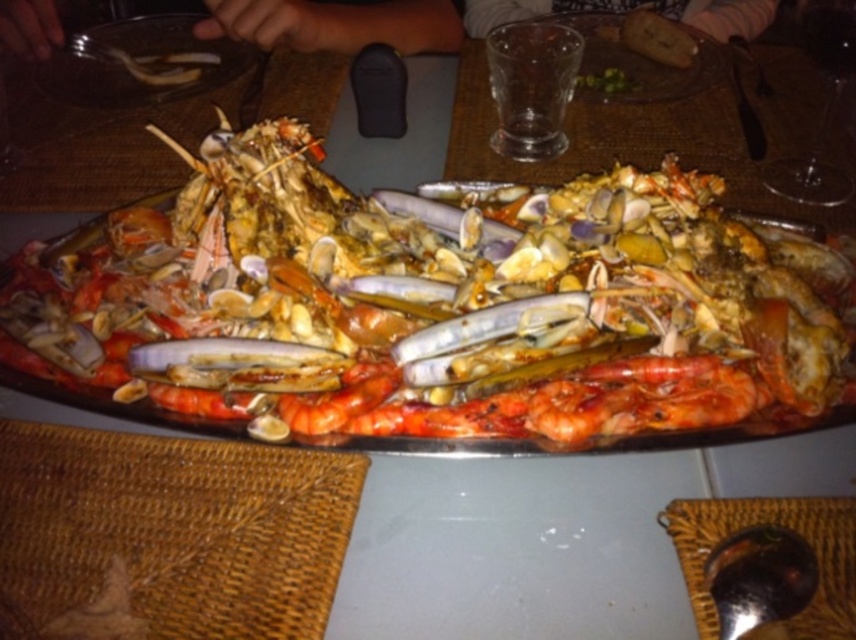
Is shiny red prawns at center bigger than matte glass platter at upper center?

Yes, shiny red prawns at center is bigger than matte glass platter at upper center.

Between point (10, 273) and point (704, 42), which one is positioned in front?

Point (10, 273)

Is point (224, 166) more distant than point (598, 67)?

No, it is not.

This screenshot has height=640, width=856. In order to click on shiny red prawns at center in this screenshot , I will do `click(434, 301)`.

Who is lower down, shiny red prawns at center or shiny red prawn at center?

shiny red prawn at center is below.

This screenshot has height=640, width=856. Describe the element at coordinates (434, 301) in the screenshot. I see `shiny red prawns at center` at that location.

Image resolution: width=856 pixels, height=640 pixels. What are the coordinates of `shiny red prawns at center` in the screenshot? It's located at (434, 301).

Measure the distance between matte glass platter at upper center and camera.

29.20 inches

How far apart are matte glass platter at upper center and shiny red prawn at center?

matte glass platter at upper center is 21.67 inches from shiny red prawn at center.

Is point (682, 70) less distant than point (328, 412)?

No.

At what (x,y) coordinates should I click in order to perform the action: click on matte glass platter at upper center. Please return your answer as a coordinate pair (x, y). Image resolution: width=856 pixels, height=640 pixels. Looking at the image, I should click on (635, 64).